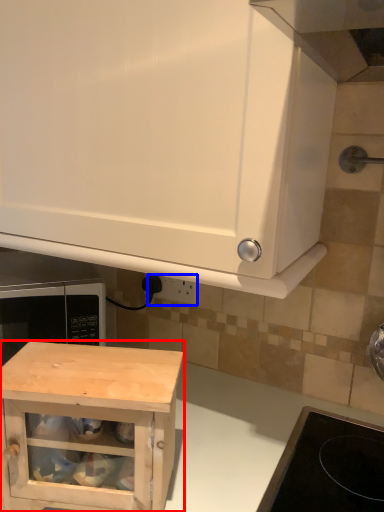
Question: Which object appears closest to the camera in this image, cabinetry (highlighted by a red box) or electric outlet (highlighted by a blue box)?

Choices:
 (A) cabinetry
 (B) electric outlet

Answer: (A)